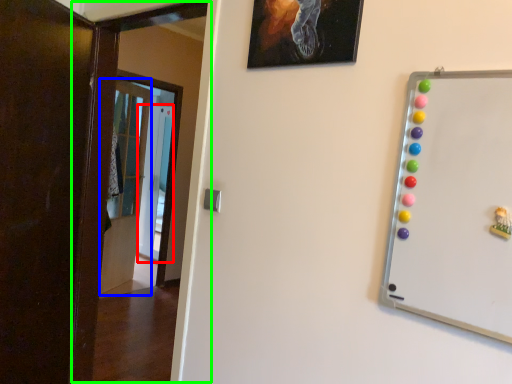
Question: Which is farther away from glass door (highlighted by a red box)? door (highlighted by a blue box) or door (highlighted by a green box)?

Choices:
 (A) door
 (B) door

Answer: (B)